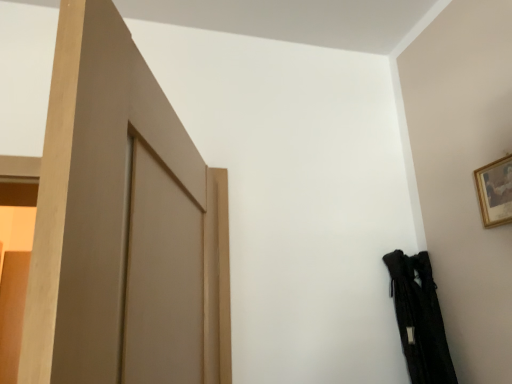
Based on the photo, what is the approximate width of gold-framed picture at upper right?

The width of gold-framed picture at upper right is 3.33 centimeters.

This screenshot has height=384, width=512. What are the coordinates of `gold-framed picture at upper right` in the screenshot? It's located at (495, 191).

Describe the element at coordinates (495, 191) in the screenshot. I see `gold-framed picture at upper right` at that location.

This screenshot has width=512, height=384. In order to click on gold-framed picture at upper right in this screenshot , I will do `click(495, 191)`.